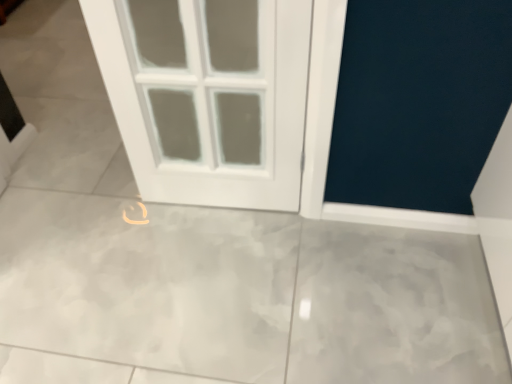
Identify the location of white glossy door at upper center. (208, 96).

What is the approximate height of white glossy door at upper center?

white glossy door at upper center is 2.76 inches tall.

Describe the element at coordinates (208, 96) in the screenshot. I see `white glossy door at upper center` at that location.

In order to click on white glossy door at upper center in this screenshot , I will do `click(208, 96)`.